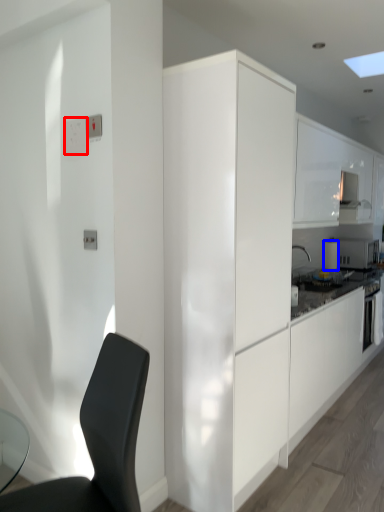
Question: Which object is further to the camera taking this photo, light switch (highlighted by a red box) or appliance (highlighted by a blue box)?

Choices:
 (A) light switch
 (B) appliance

Answer: (B)